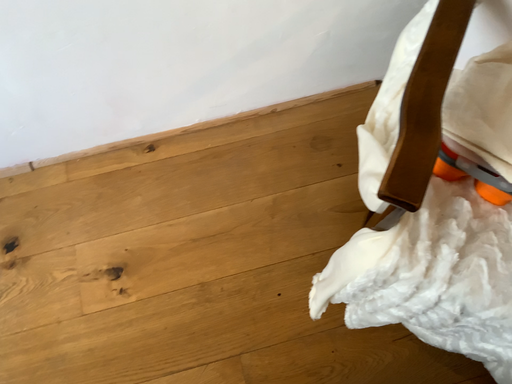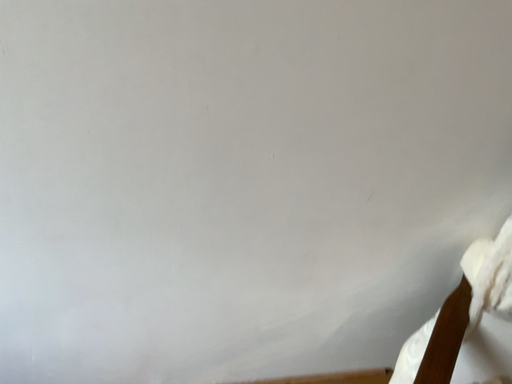
Question: Which way did the camera rotate in the video?

Choices:
 (A) rotated downward
 (B) rotated upward

Answer: (B)